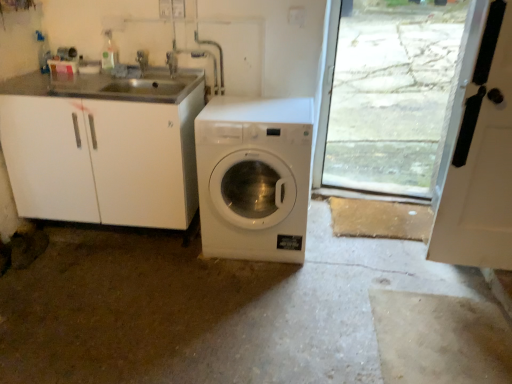
Question: From a real-world perspective, is white matte door at right above or below white glossy washing machine at center?

Choices:
 (A) below
 (B) above

Answer: (B)

Question: In terms of width, does white matte door at right look wider or thinner when compared to white glossy washing machine at center?

Choices:
 (A) wide
 (B) thin

Answer: (B)

Question: Which object is the closest to the white glossy washing machine at center?

Choices:
 (A) brushed metal faucet at upper center, the second faucet in the right-to-left sequence
 (B) white matte door at right
 (C) brushed metal faucet at upper center, which is counted as the first faucet, starting from the right

Answer: (C)

Question: Which is farther from the brushed metal faucet at upper center, the second faucet in the right-to-left sequence?

Choices:
 (A) brushed metal faucet at upper center, which is counted as the second faucet, starting from the left
 (B) white matte door at right
 (C) white glossy washing machine at center

Answer: (B)